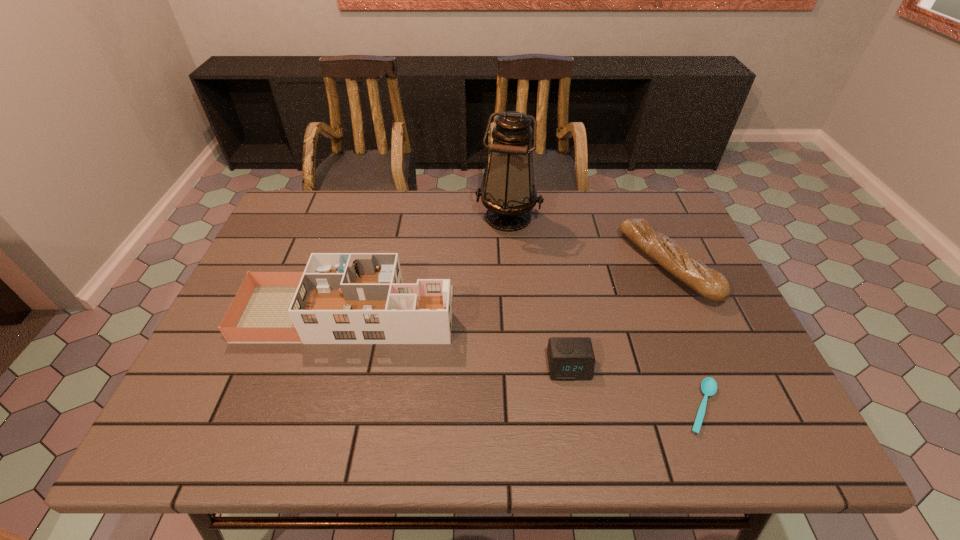
Where is `vacant space positioned on the back of the spoon`? This screenshot has height=540, width=960. vacant space positioned on the back of the spoon is located at coordinates (657, 291).

At what (x,y) coordinates should I click in order to perform the action: click on oil lamp located at the far edge. Please return your answer as a coordinate pair (x, y). Image resolution: width=960 pixels, height=540 pixels. Looking at the image, I should click on (509, 194).

Locate an element on the screen. Image resolution: width=960 pixels, height=540 pixels. baguet present at the far edge is located at coordinates (709, 283).

What are the coordinates of `object that is at the near edge` in the screenshot? It's located at 708,386.

The image size is (960, 540). I want to click on object at the left edge, so click(341, 298).

In order to click on baguet located in the right edge section of the desktop in this screenshot , I will do `click(709, 283)`.

Locate an element on the screen. spoon present at the right edge is located at coordinates (708, 386).

I want to click on object positioned at the far right corner, so click(709, 283).

At what (x,y) coordinates should I click in order to perform the action: click on object that is at the near right corner. Please return your answer as a coordinate pair (x, y). The image size is (960, 540). Looking at the image, I should click on (708, 386).

I want to click on free region at the far edge, so click(588, 194).